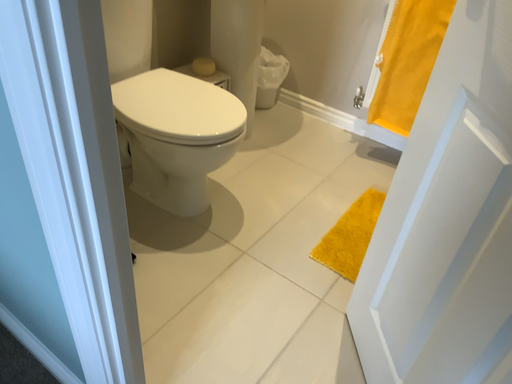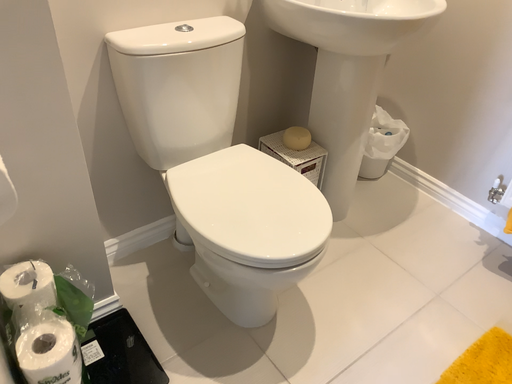
Question: Which way did the camera rotate in the video?

Choices:
 (A) rotated left
 (B) rotated right

Answer: (A)